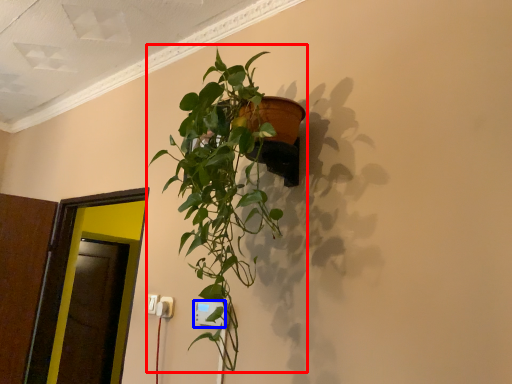
Question: Which object appears farthest to the camera in this image, houseplant (highlighted by a red box) or electric outlet (highlighted by a blue box)?

Choices:
 (A) houseplant
 (B) electric outlet

Answer: (B)